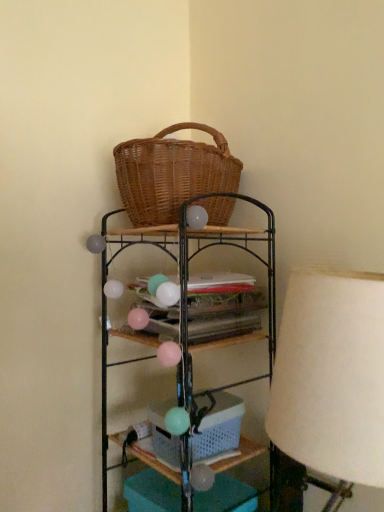
This screenshot has width=384, height=512. Describe the element at coordinates (200, 252) in the screenshot. I see `woven wood basket at upper center` at that location.

Describe the element at coordinates (219, 429) in the screenshot. I see `matte wicker basket at center` at that location.

At what (x,y) coordinates should I click in order to perform the action: click on woven wood basket at upper center. Please return your answer as a coordinate pair (x, y). Looking at the image, I should click on (200, 252).

Does point (195, 148) come farther from viewer compared to point (342, 333)?

That is True.

Which object is more forward, woven brown picnic basket at upper center or white fabric lampshade at right?

white fabric lampshade at right is closer to the camera.

Which of these two, woven brown picnic basket at upper center or white fabric lampshade at right, stands taller?

white fabric lampshade at right is taller.

Measure the distance from woven brown picnic basket at upper center to white fabric lampshade at right.

22.62 inches.

Where is `table lamp that is above the matte wicker basket at center (from a real-world perspective)`? The height and width of the screenshot is (512, 384). table lamp that is above the matte wicker basket at center (from a real-world perspective) is located at coordinates (331, 377).

Considering the relative sizes of white fabric lampshade at right and matte wicker basket at center in the image provided, is white fabric lampshade at right wider than matte wicker basket at center?

Yes, white fabric lampshade at right is wider than matte wicker basket at center.

Between white fabric lampshade at right and matte wicker basket at center, which one has more height?

Standing taller between the two is white fabric lampshade at right.

From a real-world perspective, is white fabric lampshade at right positioned above or below matte wicker basket at center?

In terms of real-world spatial position, white fabric lampshade at right is above matte wicker basket at center.

From a real-world perspective, is white fabric lampshade at right below woven wood basket at upper center?

No, from a real-world perspective, white fabric lampshade at right is not below woven wood basket at upper center.

Considering the sizes of white fabric lampshade at right and woven wood basket at upper center in the image, is white fabric lampshade at right taller or shorter than woven wood basket at upper center?

Considering their sizes, white fabric lampshade at right has less height than woven wood basket at upper center.

Does white fabric lampshade at right have a greater width compared to woven wood basket at upper center?

In fact, white fabric lampshade at right might be narrower than woven wood basket at upper center.

How much distance is there between matte wicker basket at center and white fabric lampshade at right?

matte wicker basket at center is 21.20 inches from white fabric lampshade at right.

Does matte wicker basket at center turn towards white fabric lampshade at right?

No.

Which point is more forward, (x=170, y=465) or (x=323, y=333)?

Point (x=323, y=333)

Can you confirm if matte wicker basket at center is thinner than white fabric lampshade at right?

Correct, the width of matte wicker basket at center is less than that of white fabric lampshade at right.

Which point is more distant from viewer, (363, 294) or (139, 216)?

The point (139, 216) is farther from the camera.

Considering their positions, is white fabric lampshade at right located in front of or behind woven brown picnic basket at upper center?

In the image, white fabric lampshade at right appears in front of woven brown picnic basket at upper center.

Would you consider white fabric lampshade at right to be distant from woven brown picnic basket at upper center?

They are positioned close to each other.

Can you confirm if woven wood basket at upper center is positioned to the left of white fabric lampshade at right?

Indeed, woven wood basket at upper center is positioned on the left side of white fabric lampshade at right.

From the image's perspective, which is above, woven wood basket at upper center or white fabric lampshade at right?

white fabric lampshade at right.

You are a GUI agent. You are given a task and a screenshot of the screen. Output one action in this format:
    pyautogui.click(x=<x>, y=<y>)
    Task: Click on the shelf located below the white fabric lampshade at right (from the image's perspective)
    Image resolution: width=384 pixels, height=512 pixels.
    Given the screenshot: What is the action you would take?
    pyautogui.click(x=200, y=252)

Is woven brown picnic basket at upper center at the left side of matte wicker basket at center?

Correct, you'll find woven brown picnic basket at upper center to the left of matte wicker basket at center.

Considering the relative sizes of woven brown picnic basket at upper center and matte wicker basket at center in the image provided, is woven brown picnic basket at upper center taller than matte wicker basket at center?

Correct, woven brown picnic basket at upper center is much taller as matte wicker basket at center.

Does woven brown picnic basket at upper center contain matte wicker basket at center?

No.

Between woven brown picnic basket at upper center and matte wicker basket at center, which one is positioned in front?

woven brown picnic basket at upper center is closer to the camera.

Locate an element on the screen. The width and height of the screenshot is (384, 512). table lamp in front of the woven brown picnic basket at upper center is located at coordinates (331, 377).

This screenshot has height=512, width=384. There is a matte wicker basket at center. What are the coordinates of `table lamp above it (from a real-world perspective)` in the screenshot? It's located at (331, 377).

From the picture: Based on their spatial positions, is matte wicker basket at center or white fabric lampshade at right further from woven brown picnic basket at upper center?

The object further to woven brown picnic basket at upper center is matte wicker basket at center.

When comparing their distances from woven brown picnic basket at upper center, does woven wood basket at upper center or white fabric lampshade at right seem closer?

The object closer to woven brown picnic basket at upper center is woven wood basket at upper center.

Looking at the image, which one is located closer to matte wicker basket at center, woven wood basket at upper center or white fabric lampshade at right?

woven wood basket at upper center is closer to matte wicker basket at center.

When comparing their distances from matte wicker basket at center, does white fabric lampshade at right or woven wood basket at upper center seem closer?

woven wood basket at upper center is positioned closer to the anchor matte wicker basket at center.

Which object lies nearer to the anchor point matte wicker basket at center, woven wood basket at upper center or woven brown picnic basket at upper center?

woven wood basket at upper center is closer to matte wicker basket at center.

Estimate the real-world distances between objects in this image. Which object is closer to woven brown picnic basket at upper center, white fabric lampshade at right or woven wood basket at upper center?

woven wood basket at upper center is closer to woven brown picnic basket at upper center.

Looking at the image, which one is located further to woven wood basket at upper center, matte wicker basket at center or woven brown picnic basket at upper center?

The object further to woven wood basket at upper center is matte wicker basket at center.

Which object lies further to the anchor point white fabric lampshade at right, woven brown picnic basket at upper center or matte wicker basket at center?

woven brown picnic basket at upper center is positioned further to the anchor white fabric lampshade at right.

Identify the location of shelf between white fabric lampshade at right and matte wicker basket at center along the z-axis. (200, 252).

The width and height of the screenshot is (384, 512). In order to click on table lamp between woven brown picnic basket at upper center and woven wood basket at upper center in the vertical direction in this screenshot , I will do `click(331, 377)`.

At what (x,y) coordinates should I click in order to perform the action: click on shelf between woven brown picnic basket at upper center and matte wicker basket at center in the up-down direction. Please return your answer as a coordinate pair (x, y). This screenshot has width=384, height=512. Looking at the image, I should click on (200, 252).

Where is `table lamp between woven brown picnic basket at upper center and matte wicker basket at center from top to bottom`? The image size is (384, 512). table lamp between woven brown picnic basket at upper center and matte wicker basket at center from top to bottom is located at coordinates (331, 377).